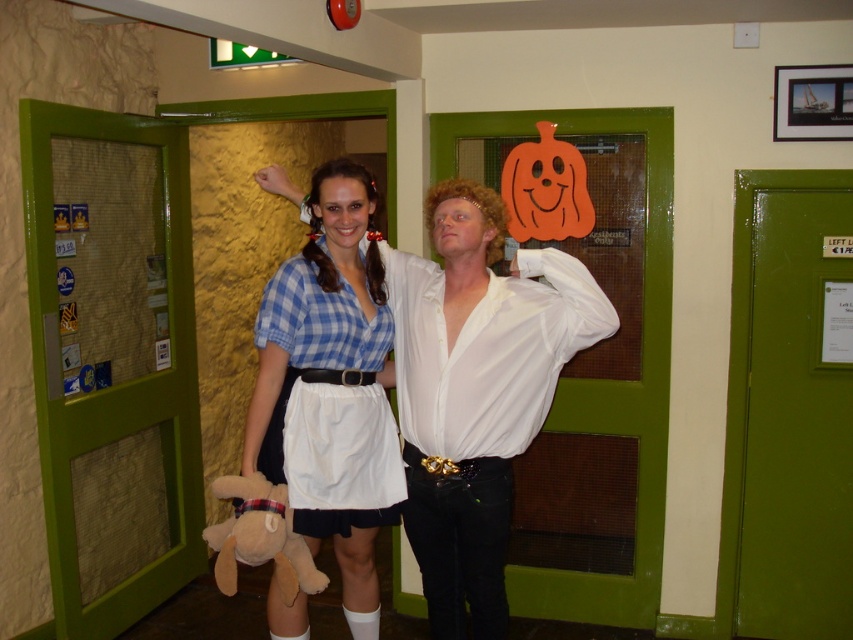
You are a photographer trying to adjust the lighting for a photo shoot. You notice two shirts in the frame, the matte blue plaid shirt at center and the blue checkered shirt at center. Which shirt should you focus on to ensure the background is properly lit, considering their positions?

The blue checkered shirt at center is behind the matte blue plaid shirt at center, so focusing on the matte blue plaid shirt at center will allow you to adjust the lighting for the foreground while the blue checkered shirt at center remains in the background.

You are a photographer setting up for a group photo. You need to position the matte blue plaid shirt at center and the blue checkered shirt at center so that they are aligned horizontally. Which one should you move upwards to achieve this alignment?

The matte blue plaid shirt at center is located below the blue checkered shirt at center. To align them horizontally, you should move the matte blue plaid shirt at center upwards to match the height of the blue checkered shirt at center.

You are organizing a photo shoot and need to ensure that the two shirts in the image are displayed properly. Given that the matte blue plaid shirt at center and the blue checkered shirt at center are both part of the setup, which shirt takes up less visual space in the photo?

The matte blue plaid shirt at center occupies less space than the blue checkered shirt at center, so the matte blue plaid shirt takes up less visual space in the photo.